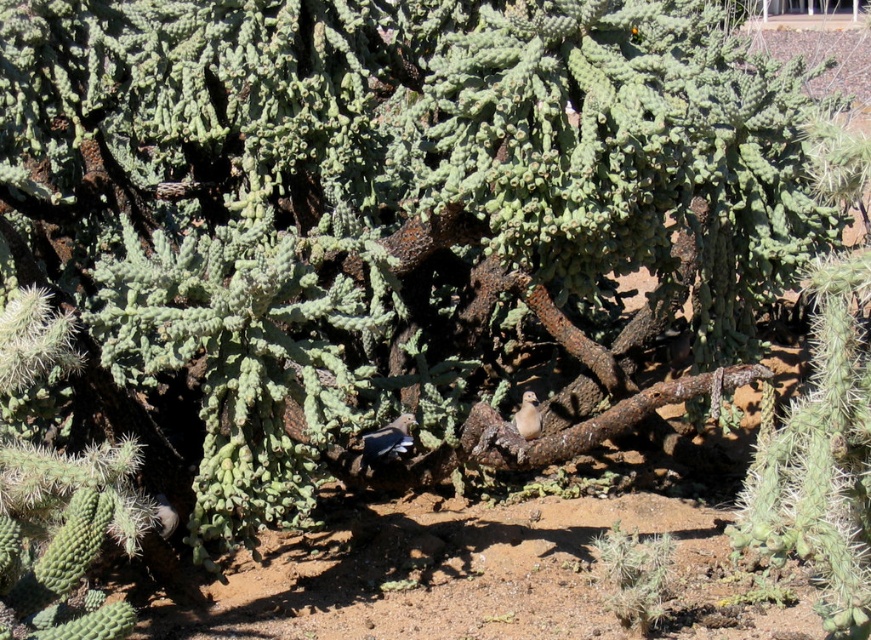
Question: Which of the following is the farthest from the observer?

Choices:
 (A) dark gray feathers at center
 (B) rusty metal branch at center

Answer: (A)

Question: Can you confirm if dark gray feathers at center is positioned below light brown feathered bird at center?

Choices:
 (A) yes
 (B) no

Answer: (A)

Question: Which point is closer to the camera?

Choices:
 (A) light brown feathered bird at center
 (B) dark gray feathers at center
 (C) rusty metal branch at center

Answer: (C)

Question: Which object is closer to the camera taking this photo?

Choices:
 (A) light brown feathered bird at center
 (B) dark gray feathers at center

Answer: (B)

Question: Is rusty metal branch at center thinner than dark gray feathers at center?

Choices:
 (A) yes
 (B) no

Answer: (B)

Question: Considering the relative positions of rusty metal branch at center and light brown feathered bird at center in the image provided, where is rusty metal branch at center located with respect to light brown feathered bird at center?

Choices:
 (A) below
 (B) above

Answer: (B)